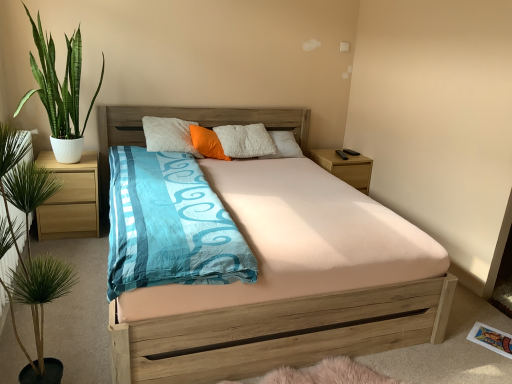
Question: Considering the positions of orange soft pillow at center and green glossy plant at left, marked as the 2th houseplant in a front-to-back arrangement, in the image, is orange soft pillow at center bigger or smaller than green glossy plant at left, marked as the 2th houseplant in a front-to-back arrangement,?

Choices:
 (A) big
 (B) small

Answer: (B)

Question: In terms of width, does orange soft pillow at center look wider or thinner when compared to green glossy plant at left, marked as the 2th houseplant in a front-to-back arrangement?

Choices:
 (A) wide
 (B) thin

Answer: (B)

Question: Estimate the real-world distances between objects in this image. Which object is closer to the orange soft pillow at center?

Choices:
 (A) green leafy plant at left, marked as the second houseplant in a back-to-front arrangement
 (B) green glossy plant at left, placed as the 1th houseplant when sorted from back to front
 (C) light brown wood at left, the 2th nightstand viewed from the back
 (D) wooden bed at center
 (E) wooden nightstand at right, which is the 1th nightstand in back-to-front order

Answer: (B)

Question: Estimate the real-world distances between objects in this image. Which object is farther from the orange soft pillow at center?

Choices:
 (A) green glossy plant at left, the second houseplant when ordered from bottom to top
 (B) light brown wood at left, the first nightstand when ordered from front to back
 (C) wooden nightstand at right, which is the 2th nightstand from left to right
 (D) green leafy plant at left, which ranks as the 1th houseplant in bottom-to-top order
 (E) wooden bed at center

Answer: (D)